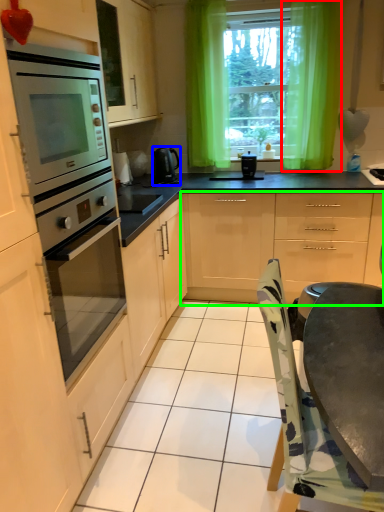
Question: Considering the real-world distances, which object is farthest from curtain (highlighted by a red box)? home appliance (highlighted by a blue box) or cabinetry (highlighted by a green box)?

Choices:
 (A) home appliance
 (B) cabinetry

Answer: (A)